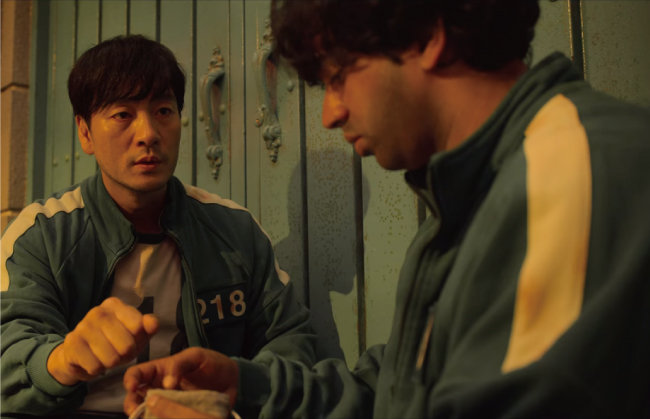
In order to click on doors in this screenshot , I will do `click(185, 22)`, `click(354, 201)`.